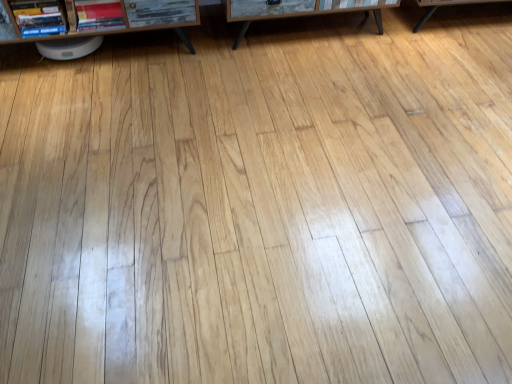
Question: Is wooden table at center located outside brown wood shelf at upper left?

Choices:
 (A) yes
 (B) no

Answer: (A)

Question: Considering the relative sizes of wooden table at center and brown wood shelf at upper left in the image provided, is wooden table at center taller than brown wood shelf at upper left?

Choices:
 (A) yes
 (B) no

Answer: (B)

Question: Can you confirm if wooden table at center is positioned to the left of brown wood shelf at upper left?

Choices:
 (A) yes
 (B) no

Answer: (B)

Question: From the image's perspective, does wooden table at center appear higher than brown wood shelf at upper left?

Choices:
 (A) yes
 (B) no

Answer: (A)

Question: Does wooden table at center have a smaller size compared to brown wood shelf at upper left?

Choices:
 (A) yes
 (B) no

Answer: (A)

Question: Considering the positions of hardcover book at upper left, arranged as the 2th book when viewed from the right, and wooden table at center in the image, is hardcover book at upper left, arranged as the 2th book when viewed from the right, bigger or smaller than wooden table at center?

Choices:
 (A) small
 (B) big

Answer: (A)

Question: From their relative heights in the image, would you say hardcover book at upper left, arranged as the 2th book when viewed from the right, is taller or shorter than wooden table at center?

Choices:
 (A) short
 (B) tall

Answer: (A)

Question: From a real-world perspective, is hardcover book at upper left, which ranks as the first book in left-to-right order, positioned above or below wooden table at center?

Choices:
 (A) below
 (B) above

Answer: (B)

Question: Relative to wooden table at center, is hardcover book at upper left, which ranks as the first book in left-to-right order, in front or behind?

Choices:
 (A) behind
 (B) front

Answer: (B)

Question: Is point pos(152,8) positioned closer to the camera than point pos(114,1)?

Choices:
 (A) closer
 (B) farther

Answer: (B)

Question: From a real-world perspective, relative to matte red book at left, the first book positioned from the right, is brown wood shelf at upper left vertically above or below?

Choices:
 (A) below
 (B) above

Answer: (A)

Question: Is brown wood shelf at upper left spatially inside matte red book at left, the first book positioned from the right, or outside of it?

Choices:
 (A) outside
 (B) inside

Answer: (A)

Question: Is brown wood shelf at upper left in front of or behind matte red book at left, the first book positioned from the right, in the image?

Choices:
 (A) behind
 (B) front

Answer: (B)

Question: Is wooden table at center inside or outside of matte red book at left, the first book positioned from the right?

Choices:
 (A) inside
 (B) outside

Answer: (B)

Question: Visually, is wooden table at center positioned to the left or to the right of matte red book at left, the 2th book in the left-to-right sequence?

Choices:
 (A) left
 (B) right

Answer: (B)